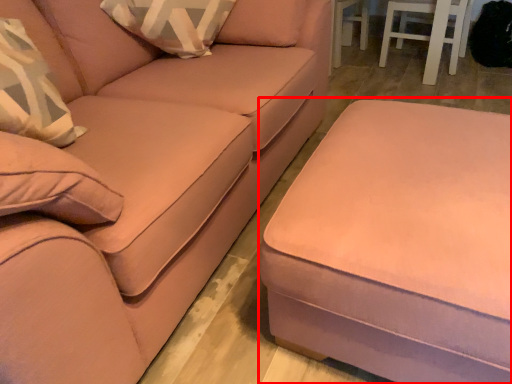
Question: Considering the relative positions of table (annotated by the red box) and studio couch in the image provided, where is table (annotated by the red box) located with respect to the staircase?

Choices:
 (A) left
 (B) right

Answer: (B)